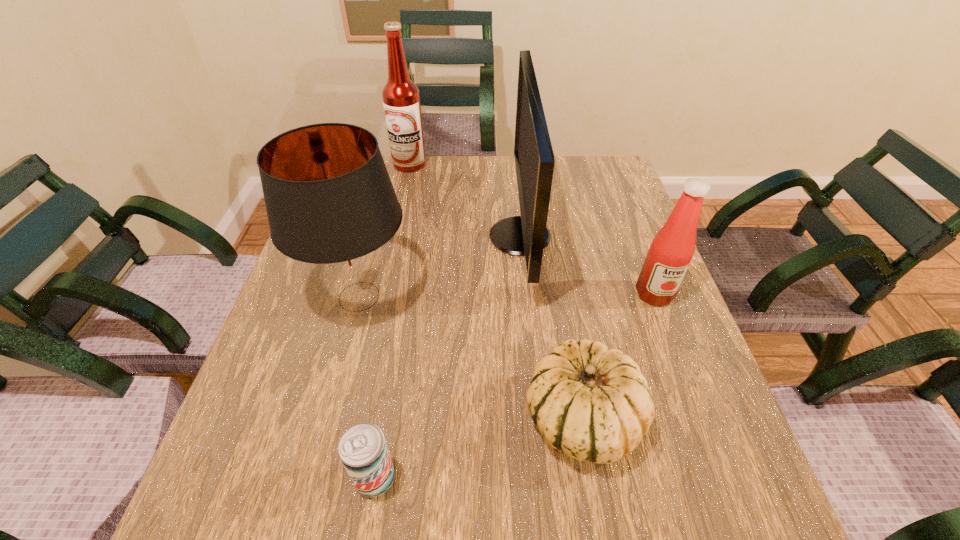
Find the location of a particular element. The height and width of the screenshot is (540, 960). condiment at the right edge is located at coordinates (671, 251).

Find the location of `gourd present at the right edge`. gourd present at the right edge is located at coordinates (591, 402).

Image resolution: width=960 pixels, height=540 pixels. In order to click on object present at the far left corner in this screenshot , I will do `click(401, 98)`.

What are the coordinates of `vacant space at the far edge of the desktop` in the screenshot? It's located at pos(494,162).

Where is `blank space at the left edge of the desktop`? blank space at the left edge of the desktop is located at coordinates (318, 392).

At what (x,y) coordinates should I click in order to perform the action: click on blank area at the right edge. Please return your answer as a coordinate pair (x, y). Looking at the image, I should click on (669, 313).

I want to click on vacant space at the far right corner of the desktop, so click(x=629, y=192).

The width and height of the screenshot is (960, 540). In order to click on empty location between the computer monitor and the farthest object in this screenshot , I will do `click(465, 200)`.

Identify the location of free spot between the computer monitor and the fifth tallest object. This screenshot has width=960, height=540. (551, 328).

Where is `free area in between the gourd and the shortest object`? This screenshot has width=960, height=540. free area in between the gourd and the shortest object is located at coordinates (479, 449).